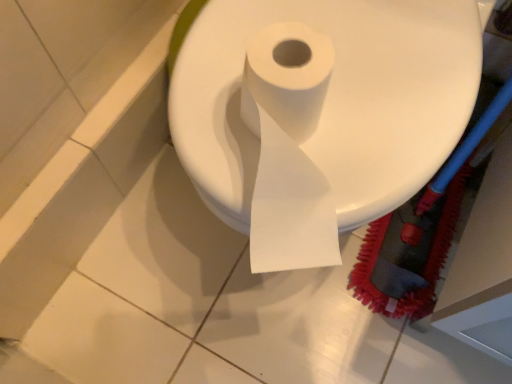
This screenshot has width=512, height=384. Describe the element at coordinates (323, 119) in the screenshot. I see `white matte toilet paper at center` at that location.

Locate an element on the screen. This screenshot has width=512, height=384. white matte toilet paper at center is located at coordinates (323, 119).

This screenshot has height=384, width=512. In order to click on white matte toilet paper at center in this screenshot , I will do `click(323, 119)`.